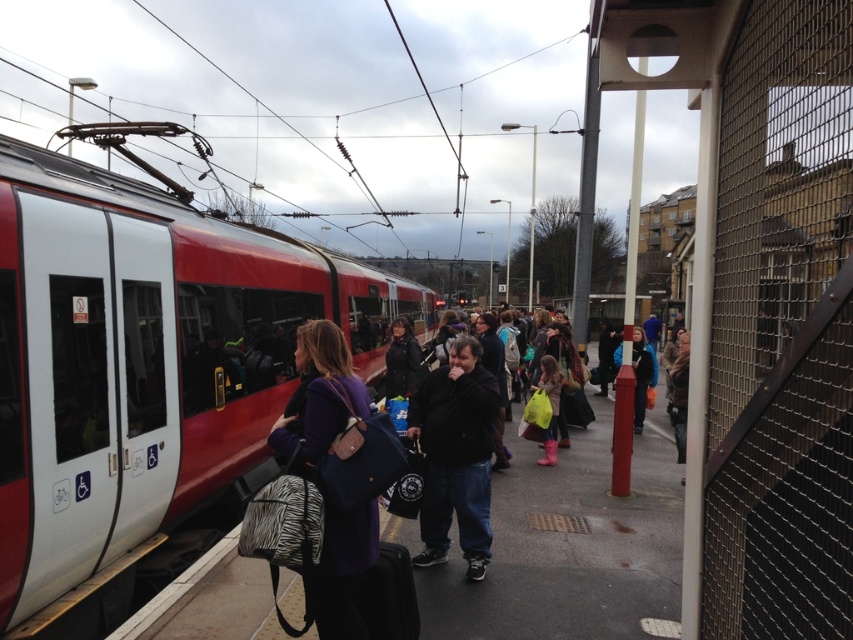
How much distance is there between dark blue fabric jacket at center and black cotton jacket at center?

They are 10.28 feet apart.

From the picture: Who is higher up, dark blue fabric jacket at center or black cotton jacket at center?

black cotton jacket at center

Which is in front, point (622, 524) or point (469, 518)?

Point (469, 518) is more forward.

Identify the location of dark blue fabric jacket at center. (572, 547).

Does red matte train at left appear over black cotton jacket at center?

Correct, red matte train at left is located above black cotton jacket at center.

Which is above, red matte train at left or black cotton jacket at center?

red matte train at left is above.

Between point (10, 397) and point (454, 419), which one is positioned behind?

The point (454, 419) is behind.

Identify the location of red matte train at left. Image resolution: width=853 pixels, height=640 pixels. pyautogui.click(x=144, y=362).

Between red matte train at left and dark blue fabric jacket at center, which one has more height?

With more height is red matte train at left.

Is red matte train at left closer to camera compared to dark blue fabric jacket at center?

That is True.

Locate an element on the screen. The height and width of the screenshot is (640, 853). red matte train at left is located at coordinates (144, 362).